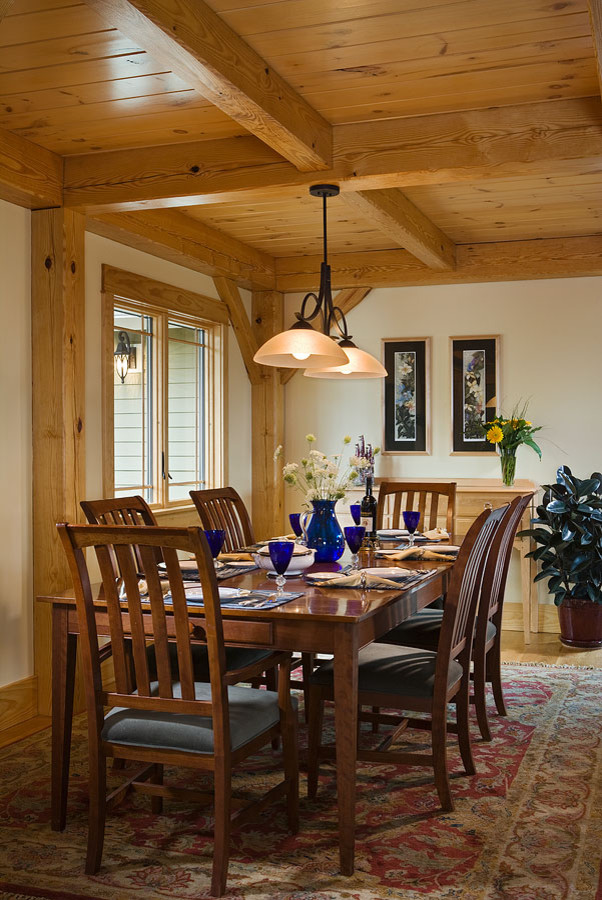
Where is `cup`? This screenshot has width=602, height=900. cup is located at coordinates (280, 558), (355, 538), (296, 519), (409, 518), (355, 509), (217, 538).